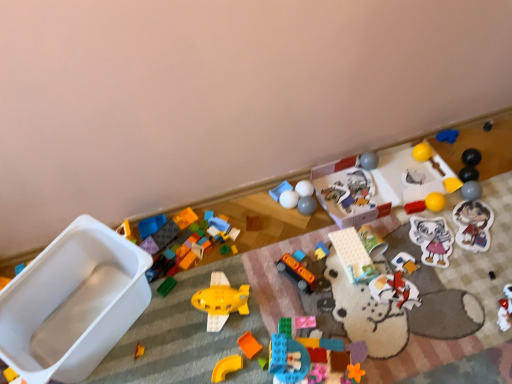
At what (x,y) coordinates should I click in order to perform the action: click on vacant area that lies between orange matte bus at center, the sixteenth toy in the right-to-left sequence, and orange matte block at center, which is the twentieth toy from right to left. Please return your answer as a coordinate pair (x, y). Looking at the image, I should click on (273, 310).